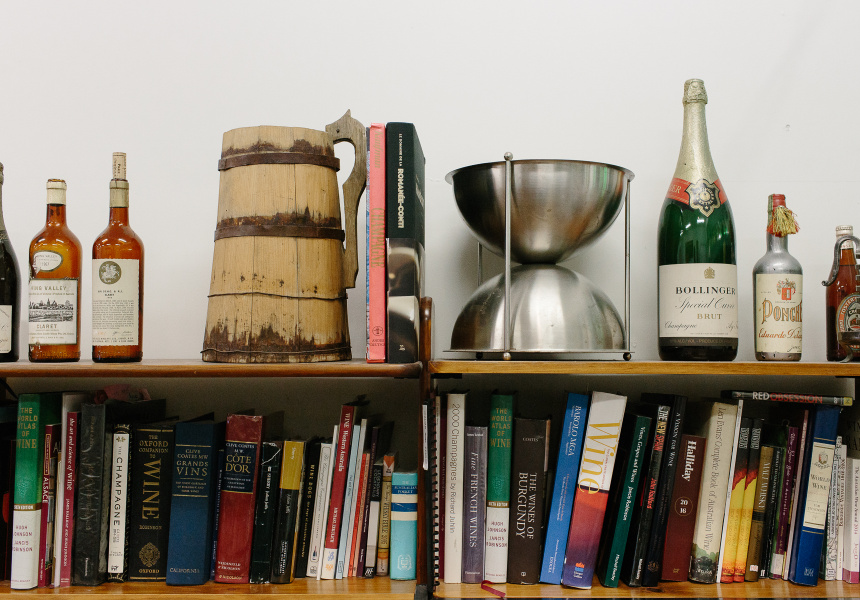
At what (x,y) coordinates should I click in order to perform the action: click on amber bottle with beige cork. Please return your answer as a coordinate pair (x, y). Looking at the image, I should click on (120, 246).